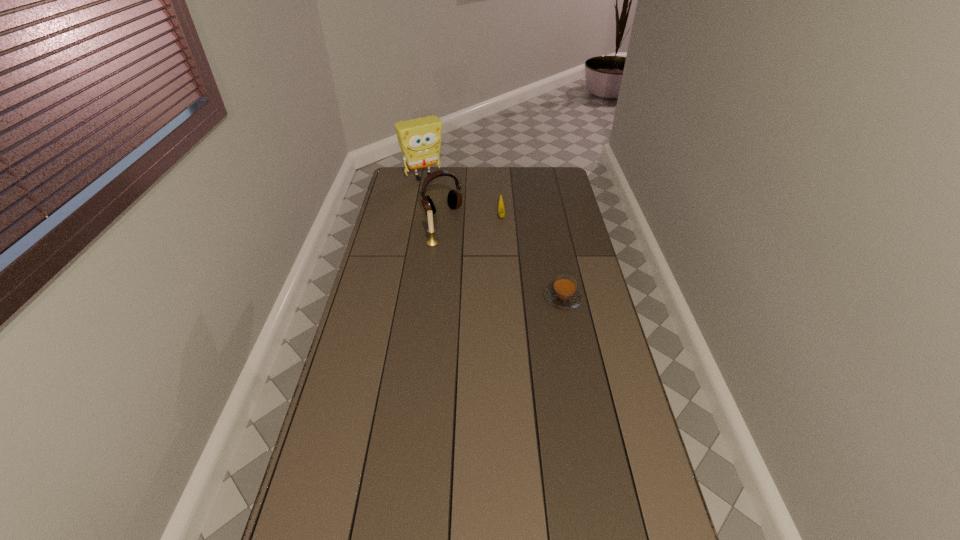
Find the location of a particular element. object at the left edge is located at coordinates (419, 139).

At what (x,y) coordinates should I click in order to perform the action: click on object situated at the right edge. Please return your answer as a coordinate pair (x, y). This screenshot has height=540, width=960. Looking at the image, I should click on (563, 294).

Where is `object that is at the far left corner`? The width and height of the screenshot is (960, 540). object that is at the far left corner is located at coordinates (419, 139).

This screenshot has width=960, height=540. Identify the location of free spot at the far edge of the desktop. (455, 187).

At what (x,y) coordinates should I click in order to perform the action: click on vacant region at the left edge of the desktop. Please return your answer as a coordinate pair (x, y). The height and width of the screenshot is (540, 960). Looking at the image, I should click on 384,354.

Locate an element on the screen. vacant point at the right edge is located at coordinates (610, 449).

Where is `free space at the near left corner of the desktop`? free space at the near left corner of the desktop is located at coordinates (308, 520).

The height and width of the screenshot is (540, 960). In order to click on vacant area at the far right corner in this screenshot , I will do `click(554, 190)`.

At what (x,y) coordinates should I click in order to perform the action: click on vacant region between the third shortest object and the banana. Please return your answer as a coordinate pair (x, y). Looking at the image, I should click on (467, 229).

This screenshot has width=960, height=540. Identify the location of vacant space in between the third shortest object and the rightmost object. (497, 271).